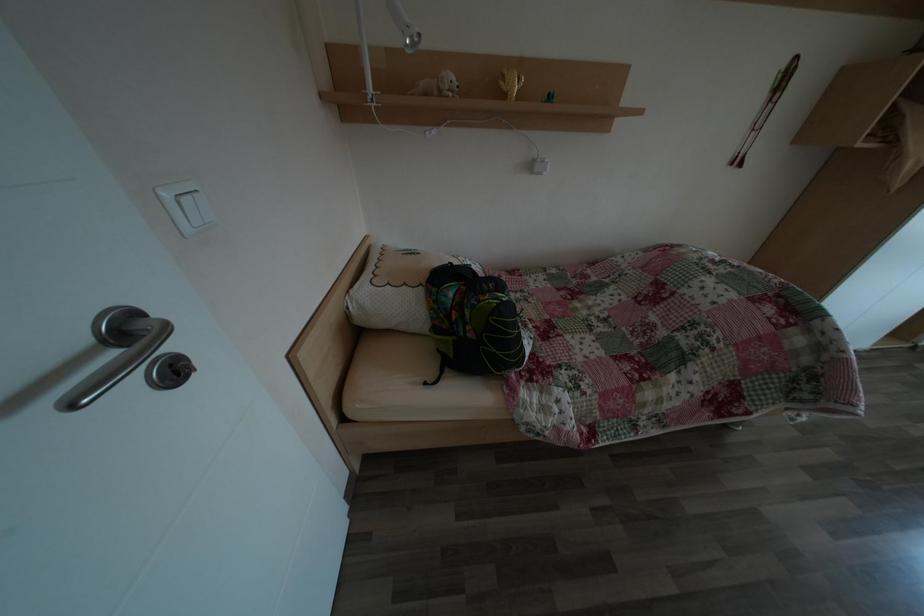
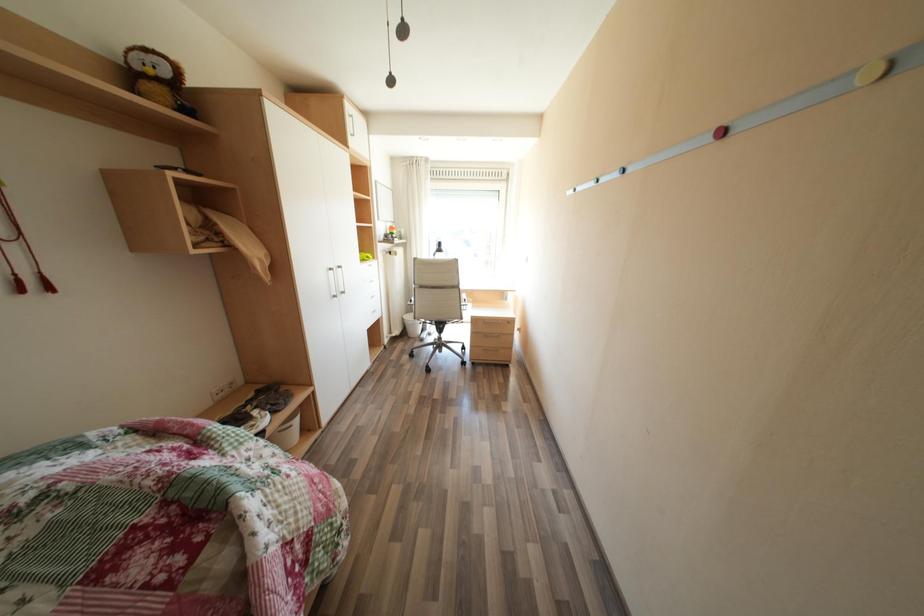
Question: The camera is either moving clockwise (left) or counter-clockwise (right) around the object. The first image is from the beginning of the video and the second image is from the end. Is the camera moving left or right when shooting the video?

Choices:
 (A) Left
 (B) Right

Answer: (A)